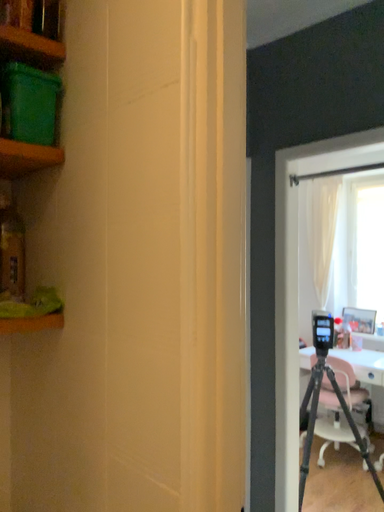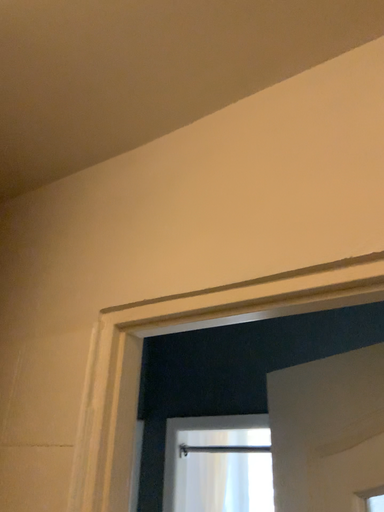
Question: How did the camera likely rotate when shooting the video?

Choices:
 (A) rotated downward
 (B) rotated upward

Answer: (B)